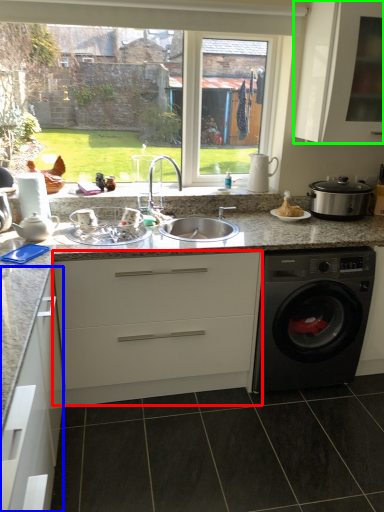
Question: Considering the real-world distances, which object is farthest from cabinetry (highlighted by a red box)? cabinetry (highlighted by a blue box) or cabinetry (highlighted by a green box)?

Choices:
 (A) cabinetry
 (B) cabinetry

Answer: (B)